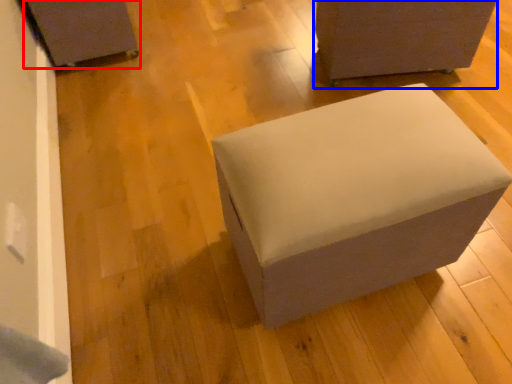
Question: Among these objects, which one is farthest to the camera, furniture (highlighted by a red box) or furniture (highlighted by a blue box)?

Choices:
 (A) furniture
 (B) furniture

Answer: (A)